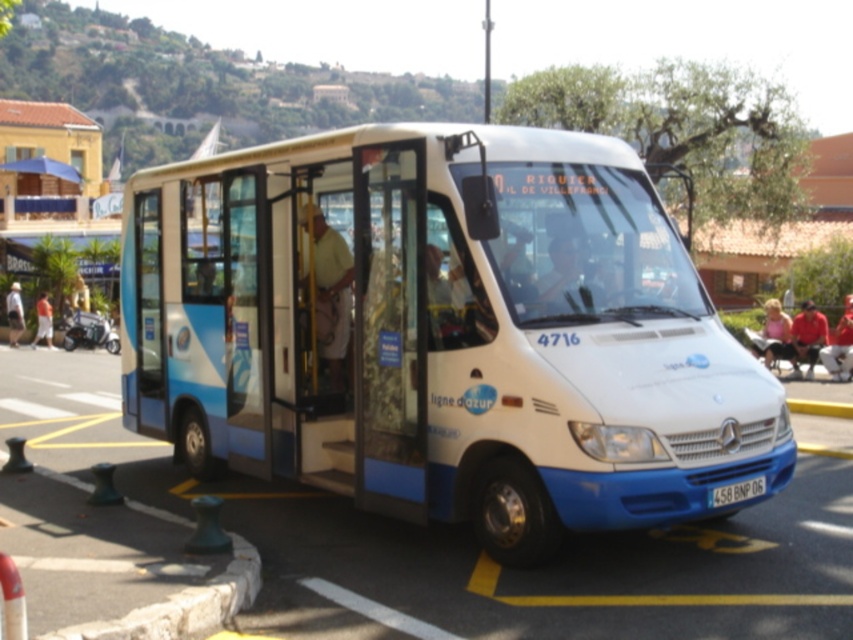
Consider the image. You are a pedestrian standing at the light blue fabric pants at left. You need to cross the street to reach the white glossy van at center. The road has a speed limit of 30 km per hour. Can you safely cross the street before the van moves forward? Assume it takes you 10 seconds to cross and the van accelerates at 2 m per second squared.

The white glossy van at center is 26.10 meters away from the light blue fabric pants at left. Since it takes 10 seconds to cross the street, the van would accelerate to 20 m per second after 10 seconds, covering a distance of 100 meters. Since the van is only 26.10 meters away, it would reach you before you finish crossing. Therefore, it is not safe to cross.

You are a pedestrian standing on the sidewalk and see the red fabric pants at lower right and the orange shirt at left. Which clothing item is positioned lower in the image?

The red fabric pants at lower right is located below orange shirt at left, so the red fabric pants at lower right is positioned lower in the image.

You are standing in front of the white and blue minibus parked on the street. There are two points marked on the bus. The first point is at coordinate (846, 333) and the second is at (39, 336). Which point is closer to you?

The point at coordinate (846, 333) is closer to you than the point at (39, 336).